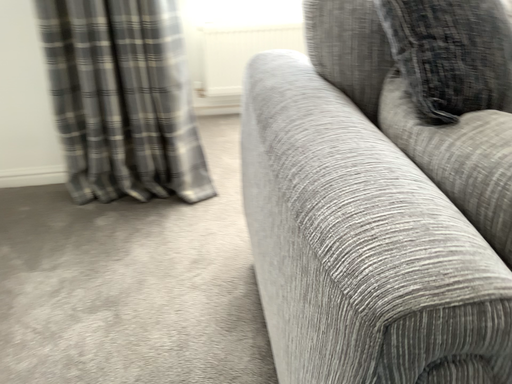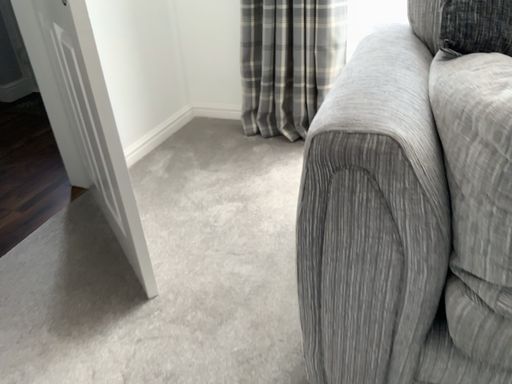
Question: How did the camera likely rotate when shooting the video?

Choices:
 (A) rotated right
 (B) rotated left

Answer: (B)